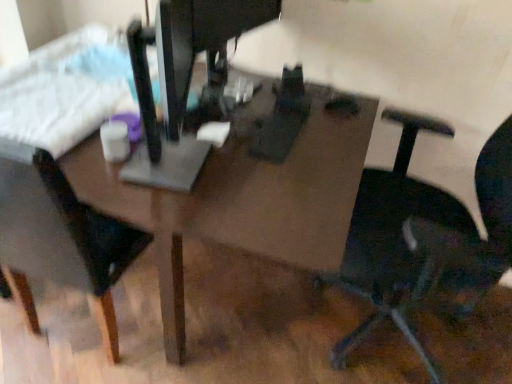
At what (x,y) coordinates should I click in order to perform the action: click on free region under metallic gray sewing machine at center (from a real-world perspective). Please return your answer as a coordinate pair (x, y). Looking at the image, I should click on (185, 187).